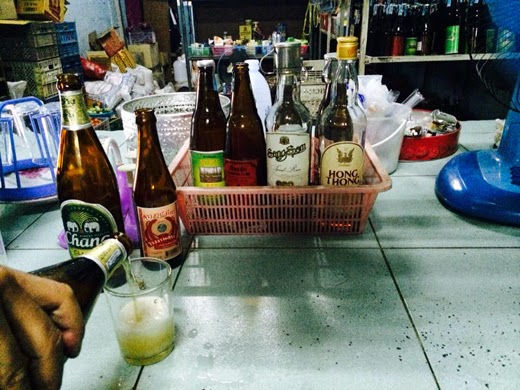
Where is `shelf`? The width and height of the screenshot is (520, 390). shelf is located at coordinates (409, 63).